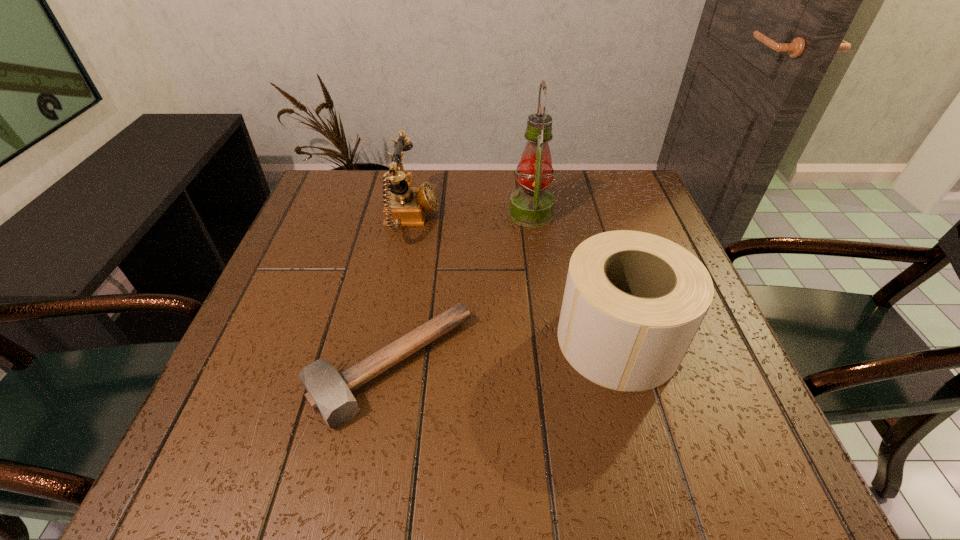
At what (x,y) coordinates should I click in order to perform the action: click on object located in the near edge section of the desktop. Please return your answer as a coordinate pair (x, y). Looking at the image, I should click on (328, 392).

At what (x,y) coordinates should I click in order to perform the action: click on object at the left edge. Please return your answer as a coordinate pair (x, y). The height and width of the screenshot is (540, 960). Looking at the image, I should click on (328, 392).

You are a GUI agent. You are given a task and a screenshot of the screen. Output one action in this format:
    pyautogui.click(x=<x>, y=<y>)
    Task: Click on the object present at the right edge
    
    Given the screenshot: What is the action you would take?
    pyautogui.click(x=633, y=302)

Identify the location of object situated at the near left corner. The height and width of the screenshot is (540, 960). (328, 392).

You are a GUI agent. You are given a task and a screenshot of the screen. Output one action in this format:
    pyautogui.click(x=<x>, y=<y>)
    Task: Click on the vacant space at the far edge of the desktop
    Image resolution: width=960 pixels, height=540 pixels.
    Given the screenshot: What is the action you would take?
    pyautogui.click(x=555, y=183)

Identify the location of free space at the near edge of the desktop. (588, 442).

This screenshot has height=540, width=960. Identify the location of vacant area at the left edge. (354, 237).

At what (x,y) coordinates should I click in order to perform the action: click on free space at the right edge. Please return your answer as a coordinate pair (x, y). This screenshot has width=960, height=540. Looking at the image, I should click on (699, 426).

Where is `vacant point at the near right corner`? vacant point at the near right corner is located at coordinates (758, 463).

Identify the location of vacant space in between the telephone and the toilet tissue. (515, 280).